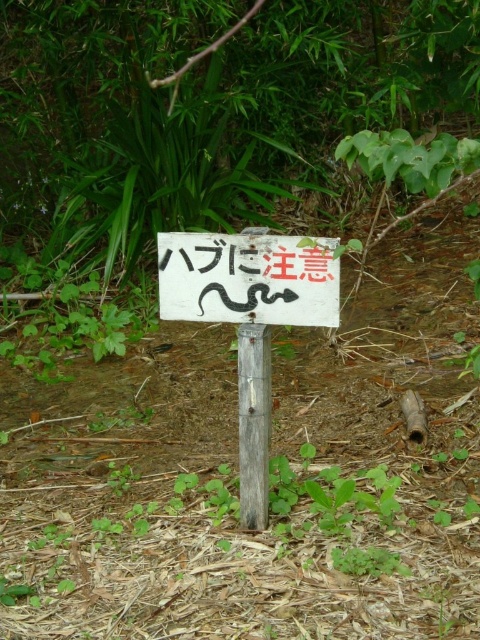
What do you see at coordinates (250, 317) in the screenshot? This screenshot has width=480, height=640. I see `white wooden sign at center` at bounding box center [250, 317].

Is white wooden sign at center above white matte sign at center?

Actually, white wooden sign at center is below white matte sign at center.

Who is more distant from viewer, (186, 282) or (184, 308)?

Point (184, 308)

Where is `white wooden sign at center`? white wooden sign at center is located at coordinates (250, 317).

Is point (328, 307) behind point (262, 337)?

No, (328, 307) is in front of (262, 337).

Is white matte sign at center below weathered wood post at center?

Incorrect, white matte sign at center is not positioned below weathered wood post at center.

Between point (175, 248) and point (261, 394), which one is positioned in front?

Point (175, 248)

You are a GUI agent. You are given a task and a screenshot of the screen. Output one action in this format:
    pyautogui.click(x=<x>, y=<y>)
    Task: Click on the white matte sign at center
    The height and width of the screenshot is (640, 480).
    Given the screenshot: What is the action you would take?
    pyautogui.click(x=248, y=278)

Is white wooden sign at center thinner than weathered wood post at center?

No.

Can you confirm if white wooden sign at center is positioned above weathered wood post at center?

Yes.

Who is more distant from viewer, (206, 292) or (267, 417)?

The point (267, 417) is more distant.

Where is `white wooden sign at center`? Image resolution: width=480 pixels, height=640 pixels. white wooden sign at center is located at coordinates pyautogui.click(x=250, y=317).